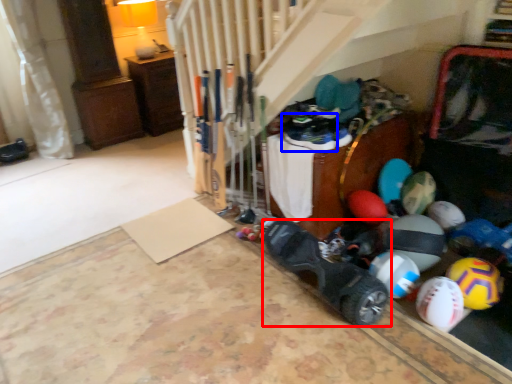
Question: Which point is closer to the camera, footwear (highlighted by a red box) or footwear (highlighted by a blue box)?

Choices:
 (A) footwear
 (B) footwear

Answer: (A)